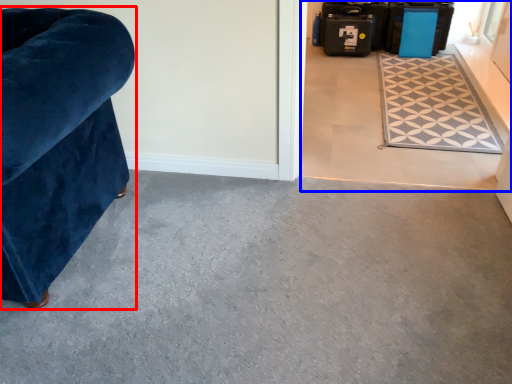
Question: Which object is closer to the camera taking this photo, furniture (highlighted by a red box) or concrete (highlighted by a blue box)?

Choices:
 (A) furniture
 (B) concrete

Answer: (A)